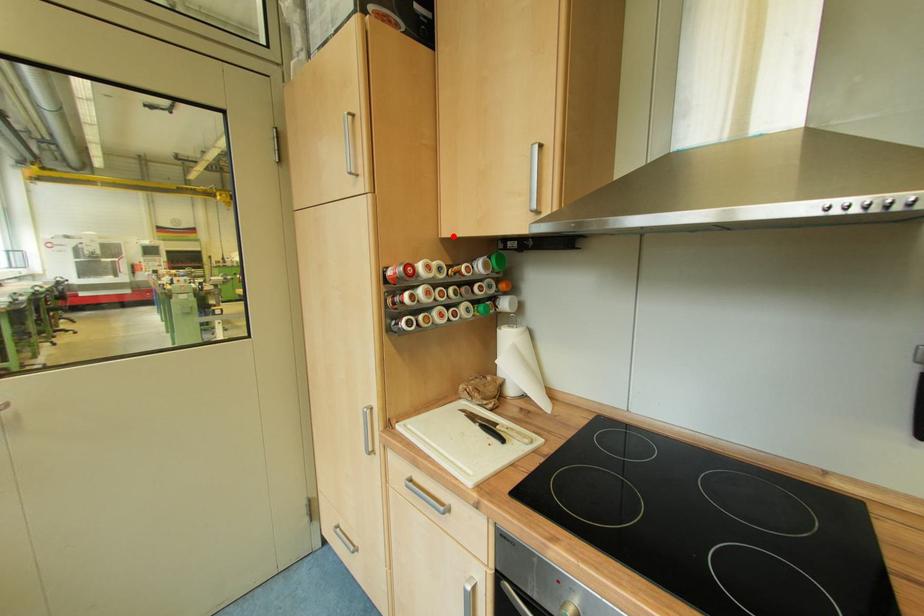
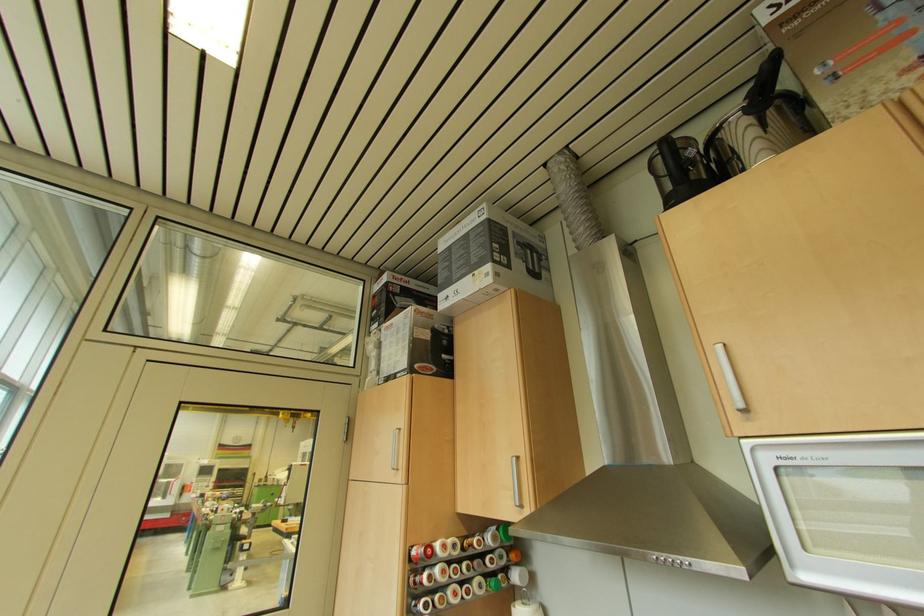
The point at the highlighted location is marked in the first image. Where is the corresponding point in the second image?

(468, 513)